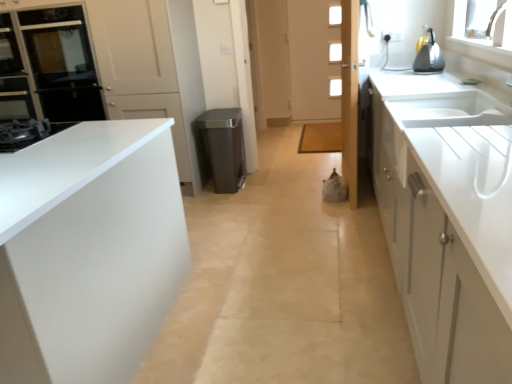
Question: Is matte black stove at left turned away from metallic silver kettle at upper right?

Choices:
 (A) no
 (B) yes

Answer: (A)

Question: From a real-world perspective, is matte black stove at left positioned over metallic silver kettle at upper right based on gravity?

Choices:
 (A) yes
 (B) no

Answer: (B)

Question: Is matte black stove at left facing towards metallic silver kettle at upper right?

Choices:
 (A) no
 (B) yes

Answer: (A)

Question: Is matte black stove at left not inside metallic silver kettle at upper right?

Choices:
 (A) no
 (B) yes

Answer: (B)

Question: Is the depth of matte black stove at left less than that of metallic silver kettle at upper right?

Choices:
 (A) no
 (B) yes

Answer: (B)

Question: From a real-world perspective, is matte black stove at left physically below metallic silver kettle at upper right?

Choices:
 (A) no
 (B) yes

Answer: (B)

Question: Is white glossy door at center, marked as the first door in a left-to-right arrangement, taller than white matte cabinet at left, which is the second cabinetry in right-to-left order?

Choices:
 (A) no
 (B) yes

Answer: (B)

Question: Considering the relative positions of white glossy door at center, the second door from the back, and white matte cabinet at left, which is the 1th cabinetry in left-to-right order, in the image provided, is white glossy door at center, the second door from the back, to the right of white matte cabinet at left, which is the 1th cabinetry in left-to-right order, from the viewer's perspective?

Choices:
 (A) no
 (B) yes

Answer: (B)

Question: Is white glossy door at center, the 2th door when ordered from front to back, positioned with its back to white matte cabinet at left, which is the 1th cabinetry in left-to-right order?

Choices:
 (A) no
 (B) yes

Answer: (A)

Question: Considering the relative sizes of white glossy door at center, the second door from the back, and white matte cabinet at left, which is the 1th cabinetry in left-to-right order, in the image provided, is white glossy door at center, the second door from the back, shorter than white matte cabinet at left, which is the 1th cabinetry in left-to-right order,?

Choices:
 (A) no
 (B) yes

Answer: (A)

Question: From a real-world perspective, is white glossy door at center, the second door from the back, located higher than white matte cabinet at left, which is the 1th cabinetry in left-to-right order?

Choices:
 (A) yes
 (B) no

Answer: (A)

Question: Is white glossy door at center, the 2th door when ordered from front to back, in contact with white matte cabinet at left, which is the 1th cabinetry in left-to-right order?

Choices:
 (A) no
 (B) yes

Answer: (A)

Question: Does white wooden door at center, the 3th door viewed from the left, turn towards black glass oven at upper left?

Choices:
 (A) yes
 (B) no

Answer: (B)